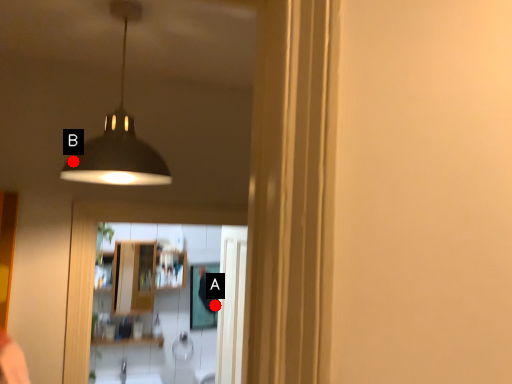
Question: Two points are circled on the image, labeled by A and B beside each circle. Which point appears closest to the camera in this image?

Choices:
 (A) A is closer
 (B) B is closer

Answer: (B)